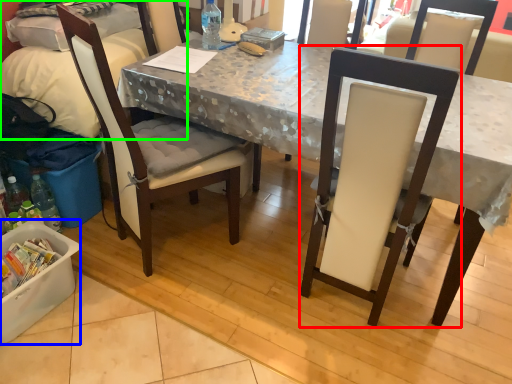
Question: Estimate the real-world distances between objects in this image. Which object is closer to chair (highlighted by a red box), box (highlighted by a blue box) or leftover (highlighted by a green box)?

Choices:
 (A) box
 (B) leftover

Answer: (A)